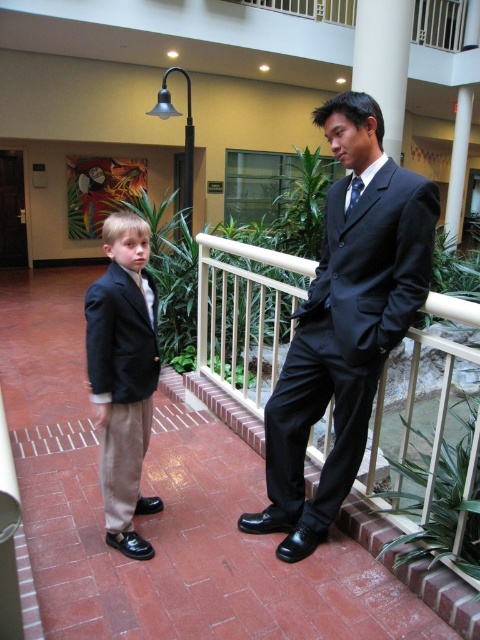
You are standing at the entrance of the atrium and want to locate the matte black suit at center. According to the coordinate system where the bottom left corner is the origin, which direction should you look to find it?

The matte black suit at center is located at coordinate point (345, 323). Since the coordinate system starts at the bottom left corner, the x value of 0.506 indicates it is slightly to the right of the center horizontally, and the y value of 0.719 means it is about 71.9 percent up from the bottom vertically. Therefore, you should look towards the upper middle section of the image, slightly to the right of center to locate the matte black suit at center.

Based on the photo, you are a photographer trying to capture both the matte black suit at center and the matte black suit at left in a single frame. Since the camera has a fixed focus, you need to ensure both subjects are in the same focal plane. Given their sizes, which one should you focus on to maximize clarity for both?

You should focus on the matte black suit at center because it is larger and will require more precise focus to maintain clarity, ensuring the smaller matte black suit at left also stays sharp.